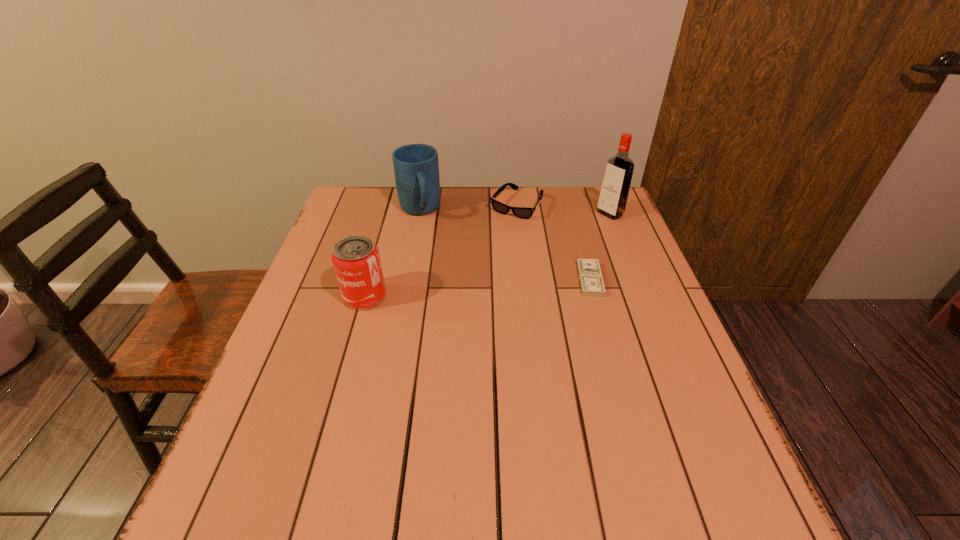
Locate an element on the screen. vacant space at the far left corner is located at coordinates (352, 226).

Find the location of `vacant space at the far right corner of the desktop`. vacant space at the far right corner of the desktop is located at coordinates (574, 213).

Find the location of a particular element. vacant region at the near right corner of the desktop is located at coordinates pyautogui.click(x=715, y=433).

The height and width of the screenshot is (540, 960). I want to click on unoccupied area between the vodka and the money, so click(600, 247).

Locate an element on the screen. The width and height of the screenshot is (960, 540). free spot between the rightmost object and the money is located at coordinates click(x=600, y=247).

Image resolution: width=960 pixels, height=540 pixels. I want to click on free space that is in between the tallest object and the third tallest object, so pos(488,255).

In order to click on free area in between the third object from right to left and the second tallest object in this screenshot , I will do `click(468, 207)`.

Where is `vacant space that is in between the mug and the can`? This screenshot has height=540, width=960. vacant space that is in between the mug and the can is located at coordinates (392, 253).

At what (x,y) coordinates should I click in order to perform the action: click on empty space between the shortest object and the tallest object. Please return your answer as a coordinate pair (x, y). The image size is (960, 540). Looking at the image, I should click on (600, 247).

The image size is (960, 540). I want to click on free point between the tallest object and the can, so click(488, 255).